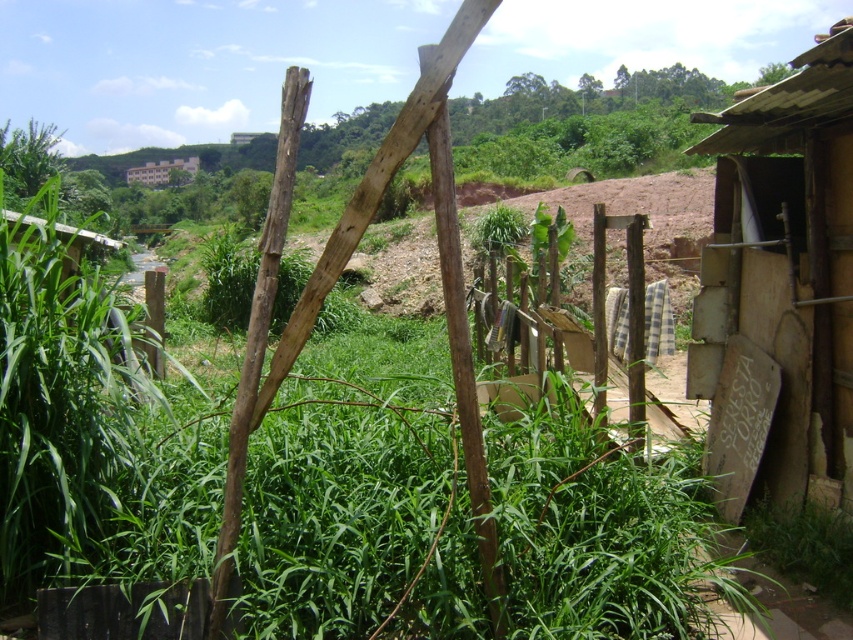
You are standing at the wooden structure in the foreground and want to walk towards the rustic building on the right. Which point, point (775, 90) or point (637, 392), is closer to you?

Point (775, 90) is closer to you because it is in front of point (637, 392).

You are standing in the rural area shown in the image. You need to place a new garden bed between the wooden fence at center and the brown wooden hut at upper center. Based on their positions, where should the garden bed be placed?

The wooden fence at center is located below the brown wooden hut at upper center, so the garden bed should be placed between them, below the brown wooden hut at upper center and above the wooden fence at center.

You are standing in the rural area shown in the image and want to approach both the wooden shack at right and the brown wooden hut at upper center. Which structure should you head towards first if you want to reach the closer one first?

You should head towards the wooden shack at right first because it is closer to the viewer than the brown wooden hut at upper center.